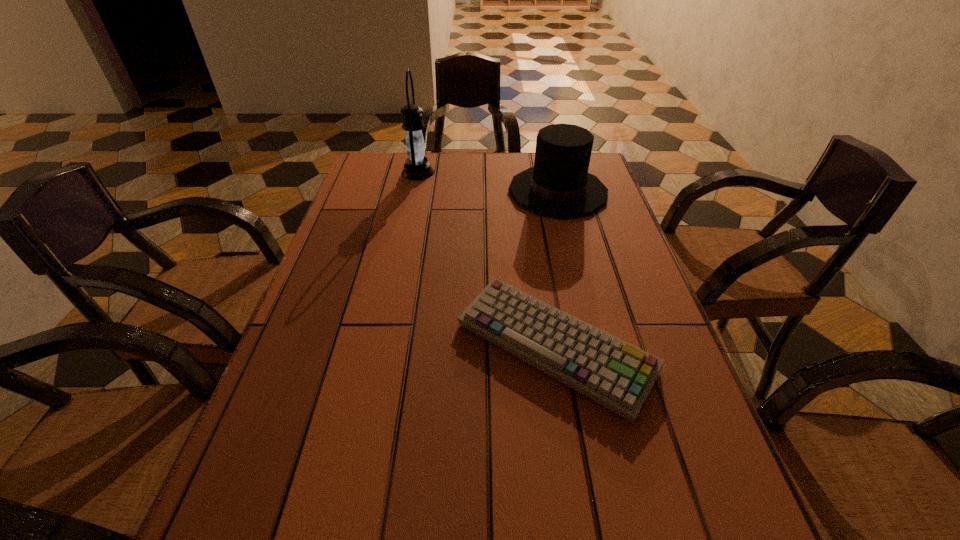
I want to click on unoccupied area between the computer keyboard and the dress hat, so click(x=556, y=270).

Find the location of a particular element. The image size is (960, 540). blank region between the leftmost object and the shortest object is located at coordinates (486, 260).

I want to click on free space between the tallest object and the computer keyboard, so click(x=486, y=260).

Where is `object that is the closest to the leftmost object`? This screenshot has width=960, height=540. object that is the closest to the leftmost object is located at coordinates (559, 185).

Point out which object is positioned as the nearest to the dress hat. Please provide its 2D coordinates. Your answer should be formatted as a tuple, i.e. [(x, y)], where the tuple contains the x and y coordinates of a point satisfying the conditions above.

[(417, 167)]

Find the location of a particular element. free location that satisfies the following two spatial constraints: 1. on the side where the tallest object emits light; 2. on the right side of the nearest object is located at coordinates (381, 348).

Locate an element on the screen. Image resolution: width=960 pixels, height=540 pixels. free point that satisfies the following two spatial constraints: 1. on the side where the tallest object emits light; 2. on the back side of the nearest object is located at coordinates (381, 348).